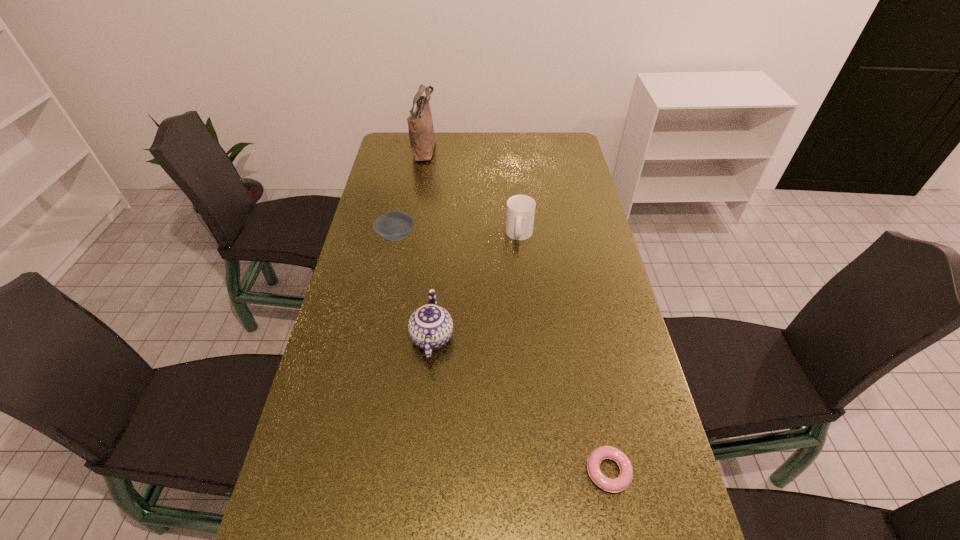
Where is `blank space located 0.280m at the spout of the chinaware`? blank space located 0.280m at the spout of the chinaware is located at coordinates (441, 245).

Where is `vacant area situated at the spout of the chinaware`? Image resolution: width=960 pixels, height=540 pixels. vacant area situated at the spout of the chinaware is located at coordinates (438, 277).

Find the location of `vacant space positioned on the front of the fourth tallest object`. vacant space positioned on the front of the fourth tallest object is located at coordinates (386, 285).

This screenshot has height=540, width=960. Find the location of `vacant space located on the left of the nearest object`. vacant space located on the left of the nearest object is located at coordinates (401, 471).

Locate an element on the screen. This screenshot has width=960, height=540. object located at the far edge is located at coordinates (420, 124).

In order to click on shoulder bag that is positioned at the left edge in this screenshot , I will do `click(420, 124)`.

At what (x,y) coordinates should I click in order to perform the action: click on bowl at the left edge. Please return your answer as a coordinate pair (x, y). The width and height of the screenshot is (960, 540). Looking at the image, I should click on (394, 226).

Locate an element on the screen. Image resolution: width=960 pixels, height=540 pixels. object situated at the right edge is located at coordinates (615, 485).

Image resolution: width=960 pixels, height=540 pixels. Find the location of `object that is at the far left corner`. object that is at the far left corner is located at coordinates (420, 124).

Where is `vacant region at the far edge of the desktop`? This screenshot has height=540, width=960. vacant region at the far edge of the desktop is located at coordinates (466, 136).